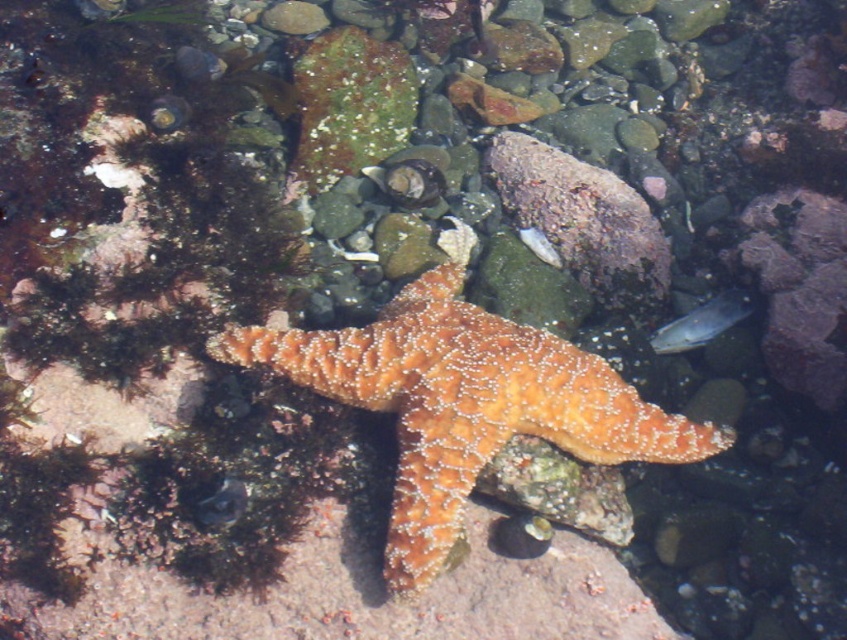
Does point (468, 316) come behind point (659, 352)?

No, (468, 316) is closer to viewer.

Based on the photo, can you confirm if orange textured starfish at center is shorter than translucent plastic fish at center?

No, orange textured starfish at center is not shorter than translucent plastic fish at center.

Find the location of `orange textured starfish at center`. orange textured starfish at center is located at coordinates (464, 403).